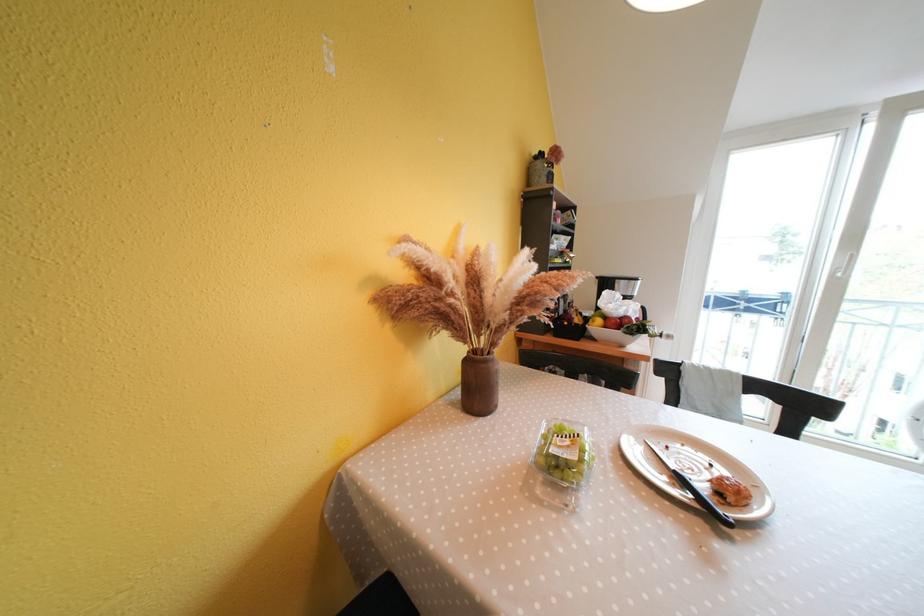
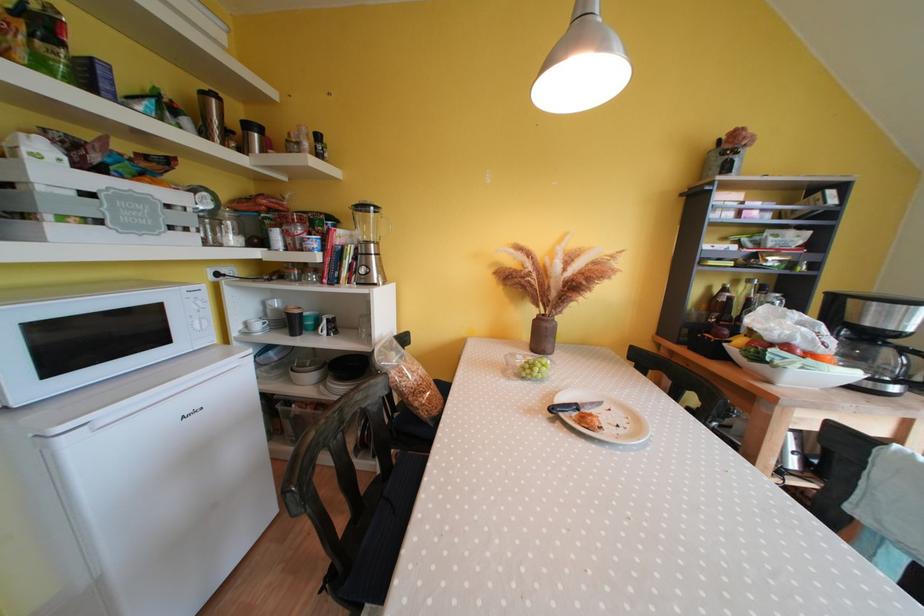
Question: The camera is either moving clockwise (left) or counter-clockwise (right) around the object. The first image is from the beginning of the video and the second image is from the end. Is the camera moving left or right when shooting the video?

Choices:
 (A) Left
 (B) Right

Answer: (B)